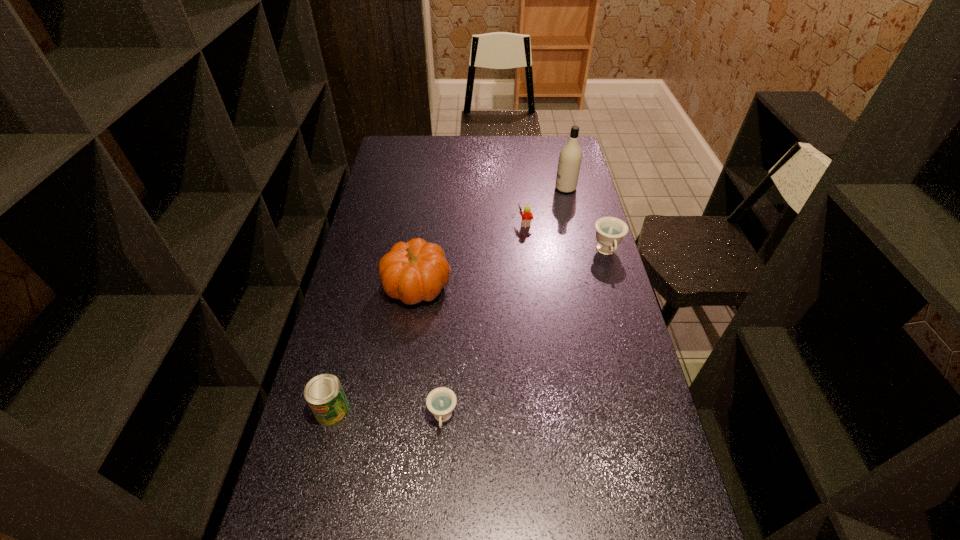
The image size is (960, 540). What are the coordinates of `can located in the left edge section of the desktop` in the screenshot? It's located at (324, 394).

This screenshot has width=960, height=540. In order to click on pumpkin that is at the left edge in this screenshot , I will do point(414,271).

At what (x,y) coordinates should I click in order to perform the action: click on teacup positioned at the right edge. Please return your answer as a coordinate pair (x, y). The image size is (960, 540). Looking at the image, I should click on (610, 231).

This screenshot has height=540, width=960. I want to click on shampoo that is at the right edge, so click(570, 157).

In the image, there is a desktop. What are the coordinates of `vacant area at the far edge` in the screenshot? It's located at (450, 156).

Locate an element on the screen. This screenshot has height=540, width=960. vacant area at the near edge of the desktop is located at coordinates (501, 504).

Locate an element on the screen. The height and width of the screenshot is (540, 960). blank area at the left edge is located at coordinates (372, 194).

Locate an element on the screen. The image size is (960, 540). vacant region at the right edge of the desktop is located at coordinates (596, 289).

Where is `free space at the far left corner of the desktop`? The image size is (960, 540). free space at the far left corner of the desktop is located at coordinates (385, 143).

The width and height of the screenshot is (960, 540). Find the location of `vacant space at the near left corner of the desktop`. vacant space at the near left corner of the desktop is located at coordinates (342, 513).